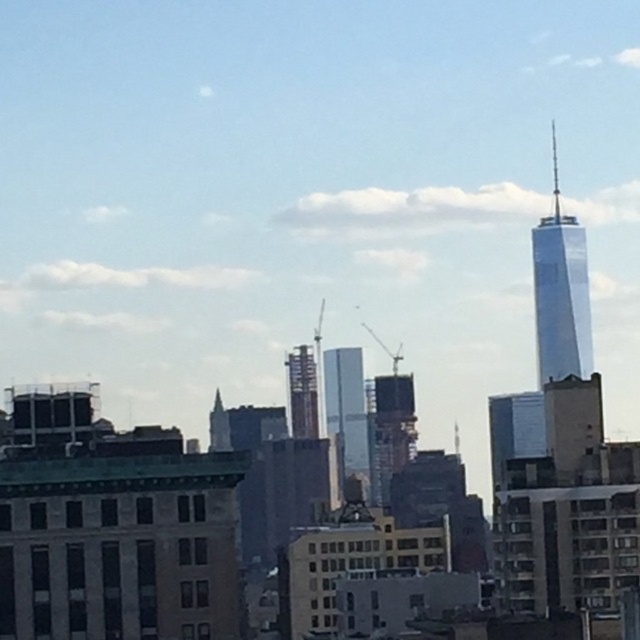
Question: Which is farther from the white glass tower at upper right?

Choices:
 (A) metallic silver tower at center
 (B) glassy reflective skyscraper at center

Answer: (A)

Question: Observing the image, what is the correct spatial positioning of white glass tower at upper right in reference to metallic silver tower at center?

Choices:
 (A) right
 (B) left

Answer: (A)

Question: Is white glass tower at upper right bigger than metallic silver tower at center?

Choices:
 (A) no
 (B) yes

Answer: (B)

Question: Based on their relative distances, which object is nearer to the metallic silver tower at center?

Choices:
 (A) glassy reflective skyscraper at center
 (B) white glass tower at upper right

Answer: (A)

Question: Which point appears closest to the camera in this image?

Choices:
 (A) (532, 257)
 (B) (332, 426)
 (C) (291, 433)

Answer: (C)

Question: Does white glass tower at upper right appear on the left side of metallic silver tower at center?

Choices:
 (A) yes
 (B) no

Answer: (B)